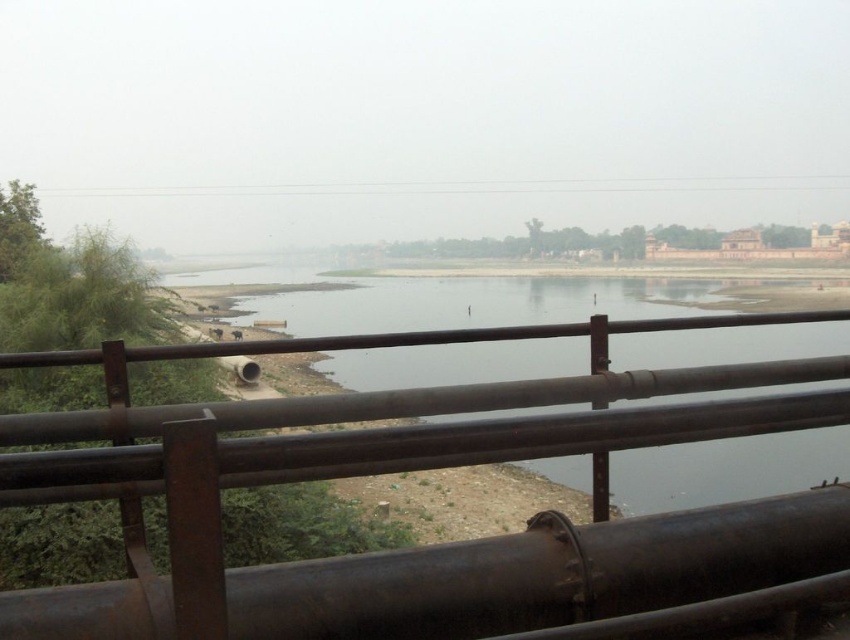
Question: Is rusty metal rail at center to the left of smooth concrete river at center from the viewer's perspective?

Choices:
 (A) yes
 (B) no

Answer: (A)

Question: Among these objects, which one is nearest to the camera?

Choices:
 (A) rusty metal rail at center
 (B) smooth concrete river at center
 (C) rusty metal water pipe at lower center

Answer: (A)

Question: Which of the following is the farthest from the observer?

Choices:
 (A) tap(491, 307)
 (B) tap(0, 467)
 (C) tap(102, 588)

Answer: (A)

Question: Where is rusty metal rail at center located in relation to smooth concrete river at center in the image?

Choices:
 (A) left
 (B) right

Answer: (A)

Question: Is rusty metal rail at center to the left of rusty metal water pipe at lower center from the viewer's perspective?

Choices:
 (A) yes
 (B) no

Answer: (B)

Question: Which point is closer to the camera?

Choices:
 (A) (462, 291)
 (B) (292, 618)

Answer: (B)